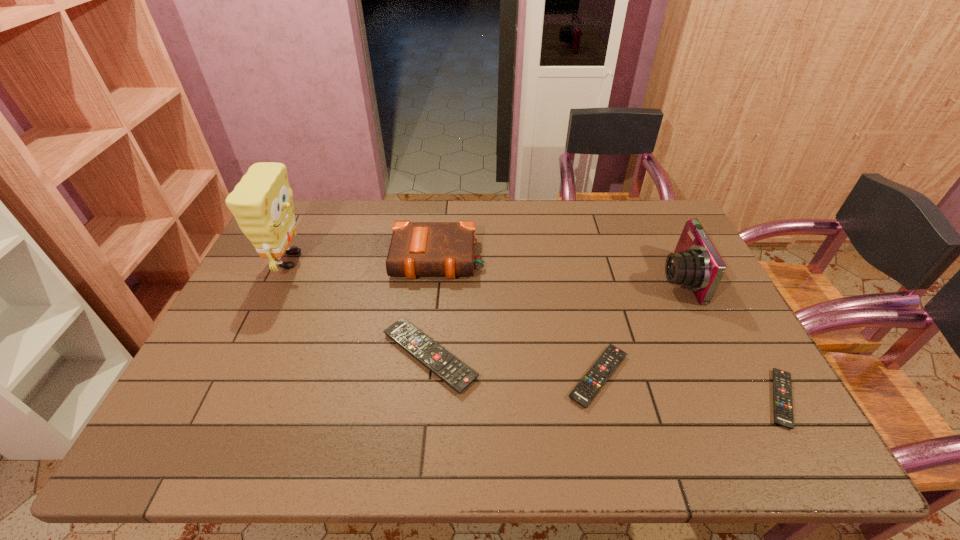
Locate an element on the screen. The width and height of the screenshot is (960, 540). vacant area in the image that satisfies the following two spatial constraints: 1. on the spine side of the Bible; 2. on the left side of the second remote control from left to right is located at coordinates (426, 376).

Where is `free space that satisfies the following two spatial constraints: 1. on the face of the third shortest object; 2. on the left side of the sponge`? This screenshot has height=540, width=960. free space that satisfies the following two spatial constraints: 1. on the face of the third shortest object; 2. on the left side of the sponge is located at coordinates (244, 356).